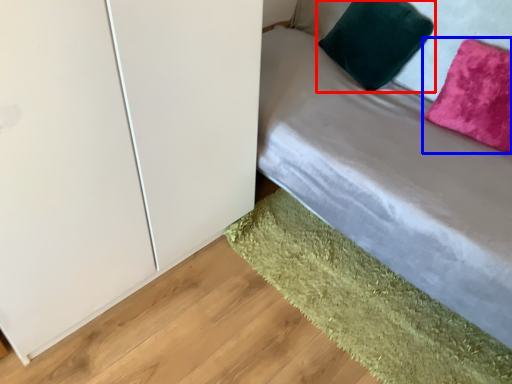
Question: Which point is closer to the camera, pillow (highlighted by a red box) or pillow (highlighted by a blue box)?

Choices:
 (A) pillow
 (B) pillow

Answer: (B)